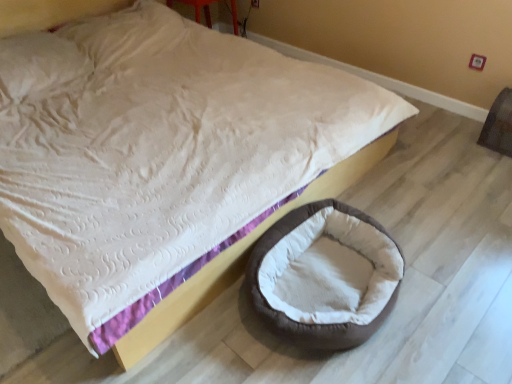
Question: From the image's perspective, is brown plush dog bed at lower right above brown fabric bean bag at right?

Choices:
 (A) yes
 (B) no

Answer: (B)

Question: Can you confirm if brown plush dog bed at lower right is bigger than brown fabric bean bag at right?

Choices:
 (A) no
 (B) yes

Answer: (B)

Question: From the image's perspective, is brown plush dog bed at lower right under brown fabric bean bag at right?

Choices:
 (A) yes
 (B) no

Answer: (A)

Question: Is brown plush dog bed at lower right behind brown fabric bean bag at right?

Choices:
 (A) yes
 (B) no

Answer: (B)

Question: From a real-world perspective, is brown plush dog bed at lower right positioned over brown fabric bean bag at right based on gravity?

Choices:
 (A) yes
 (B) no

Answer: (B)

Question: Considering the relative positions of brown plush dog bed at lower right and brown fabric bean bag at right in the image provided, is brown plush dog bed at lower right to the right of brown fabric bean bag at right from the viewer's perspective?

Choices:
 (A) yes
 (B) no

Answer: (B)

Question: Considering the relative sizes of brown fabric bean bag at right and brown plush dog bed at lower right in the image provided, is brown fabric bean bag at right taller than brown plush dog bed at lower right?

Choices:
 (A) yes
 (B) no

Answer: (A)

Question: Can you confirm if brown fabric bean bag at right is wider than brown plush dog bed at lower right?

Choices:
 (A) yes
 (B) no

Answer: (B)

Question: Is brown fabric bean bag at right aimed at brown plush dog bed at lower right?

Choices:
 (A) no
 (B) yes

Answer: (B)

Question: Is brown plush dog bed at lower right inside brown fabric bean bag at right?

Choices:
 (A) no
 (B) yes

Answer: (A)

Question: Does brown fabric bean bag at right have a larger size compared to brown plush dog bed at lower right?

Choices:
 (A) yes
 (B) no

Answer: (B)

Question: From a real-world perspective, does brown fabric bean bag at right stand above brown plush dog bed at lower right?

Choices:
 (A) no
 (B) yes

Answer: (B)

Question: Relative to brown plush dog bed at lower right, is brown fabric bean bag at right in front or behind?

Choices:
 (A) front
 (B) behind

Answer: (B)